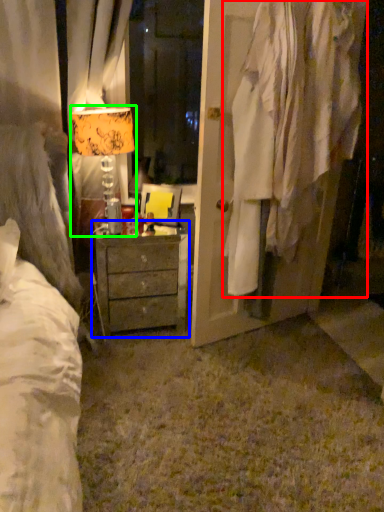
Question: Considering the real-world distances, which object is closest to clothing (highlighted by a red box)? chest of drawers (highlighted by a blue box) or table lamp (highlighted by a green box).

Choices:
 (A) chest of drawers
 (B) table lamp

Answer: (A)